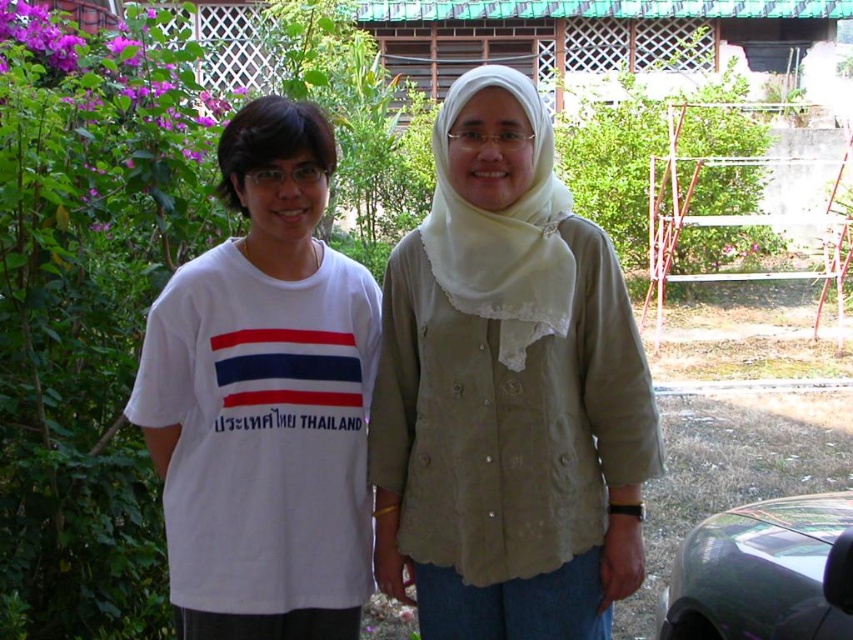
Question: Which is farther from the white cotton t-shirt at left?

Choices:
 (A) white matte shirt at center
 (B) shiny metallic car at lower right

Answer: (B)

Question: Among these objects, which one is farthest from the camera?

Choices:
 (A) white cotton t-shirt at left
 (B) shiny metallic car at lower right
 (C) white matte shirt at center

Answer: (A)

Question: Does white matte shirt at center have a lesser width compared to shiny metallic car at lower right?

Choices:
 (A) yes
 (B) no

Answer: (B)

Question: From the image, what is the correct spatial relationship of white cotton t-shirt at left in relation to shiny metallic car at lower right?

Choices:
 (A) left
 (B) right

Answer: (A)

Question: Where is white matte shirt at center located in relation to shiny metallic car at lower right in the image?

Choices:
 (A) right
 (B) left

Answer: (B)

Question: Among these objects, which one is farthest from the camera?

Choices:
 (A) white matte shirt at center
 (B) white cotton t-shirt at left

Answer: (B)